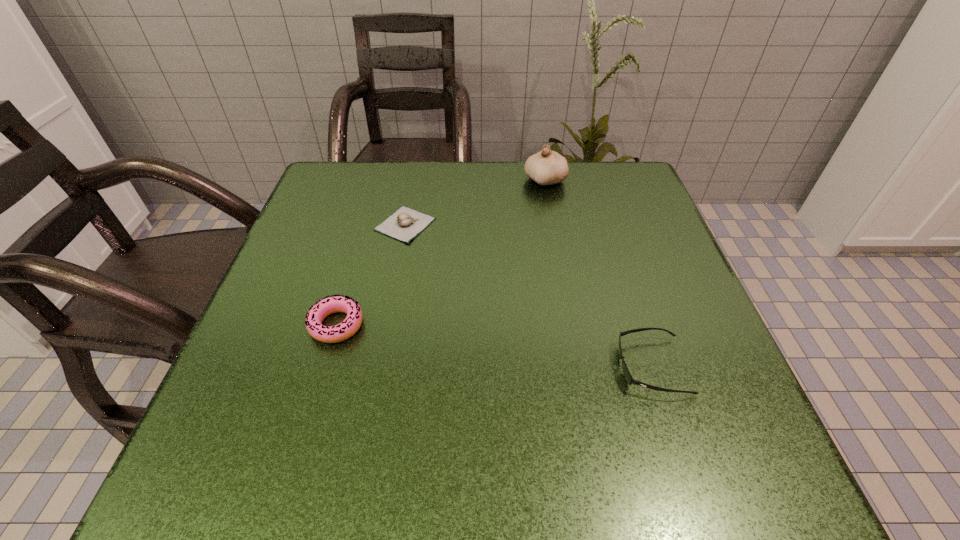
Locate an element on the screen. This screenshot has width=960, height=540. vacant space that is in between the tallest object and the sunglasses is located at coordinates click(598, 274).

Identify the location of the closest object to the doughnut. (404, 224).

Where is `object that is the second closest one to the shortest object`? This screenshot has height=540, width=960. object that is the second closest one to the shortest object is located at coordinates 546,167.

The height and width of the screenshot is (540, 960). Find the location of `free space in the image that satisfies the following two spatial constraints: 1. on the back side of the third nearest object; 2. on the left side of the tallest object`. free space in the image that satisfies the following two spatial constraints: 1. on the back side of the third nearest object; 2. on the left side of the tallest object is located at coordinates (414, 181).